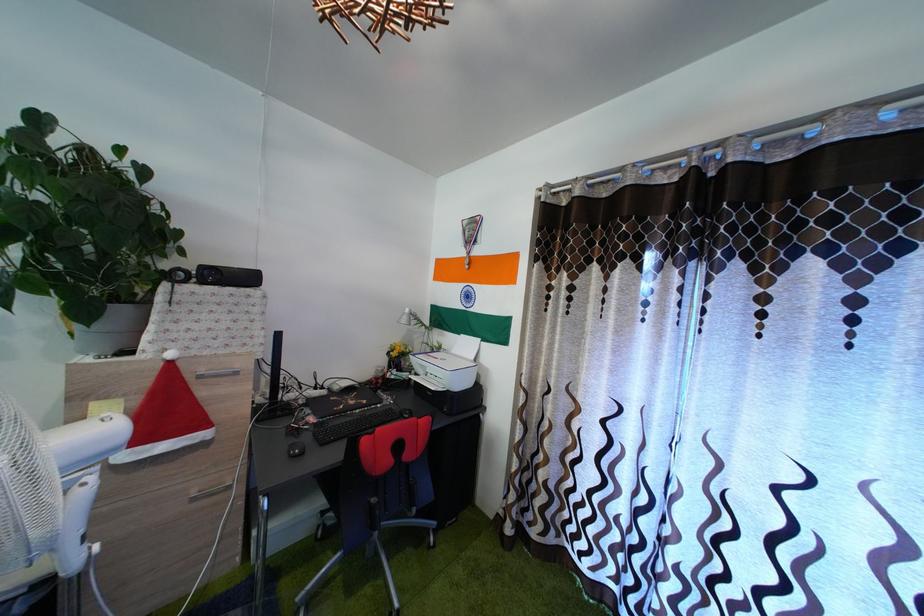
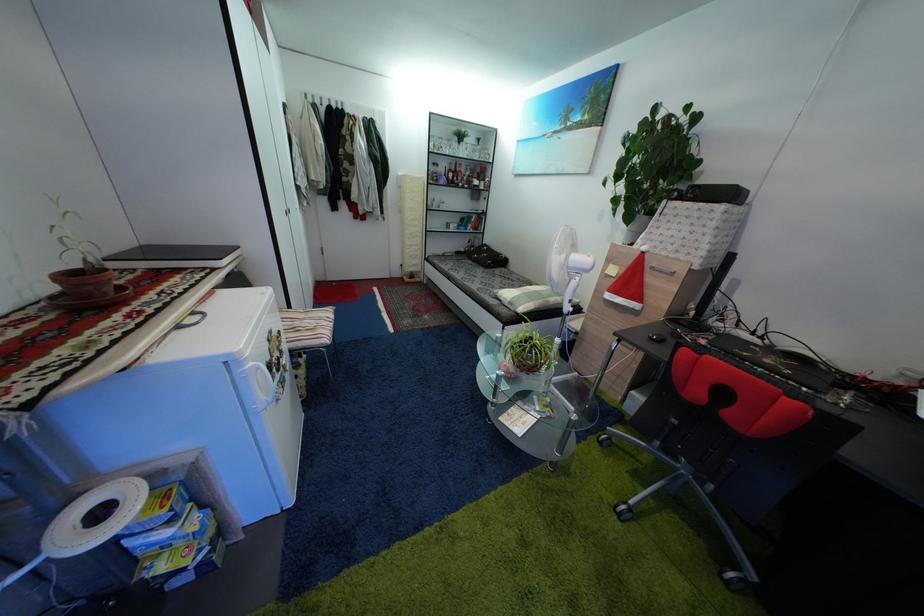
Based on the continuous images, in which direction is the camera rotating?

The camera rotated toward left-down.